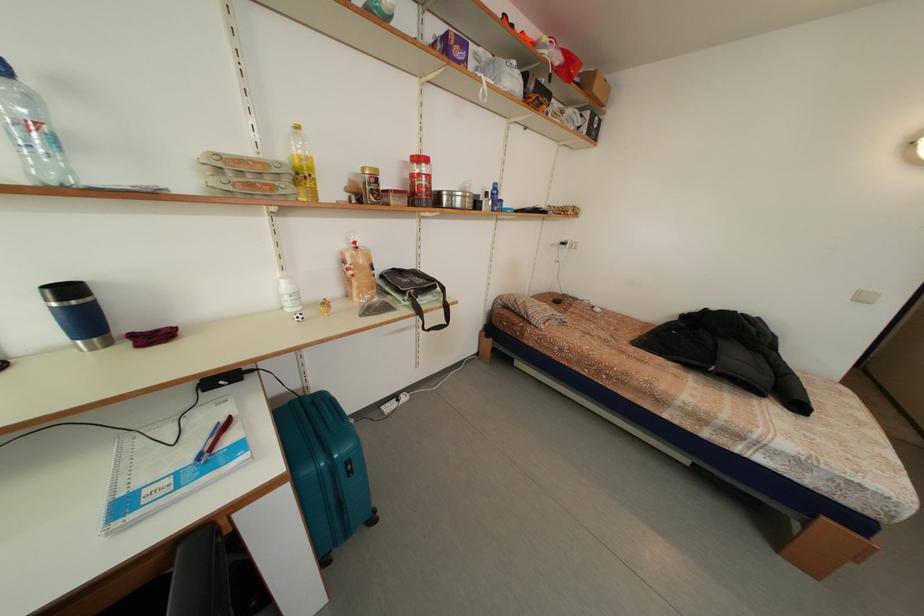
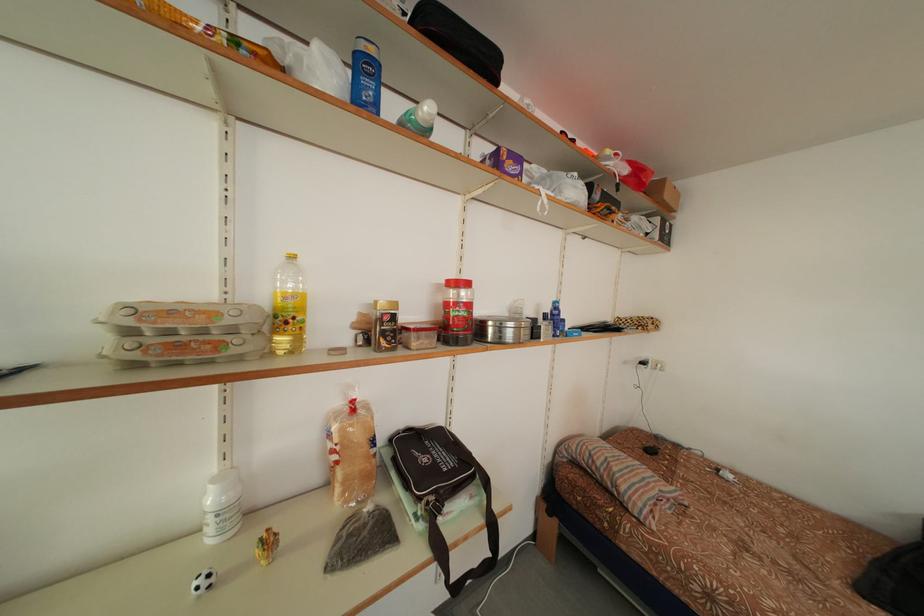
In the second image, find the point that corresponds to point (570, 249) in the first image.

(650, 369)